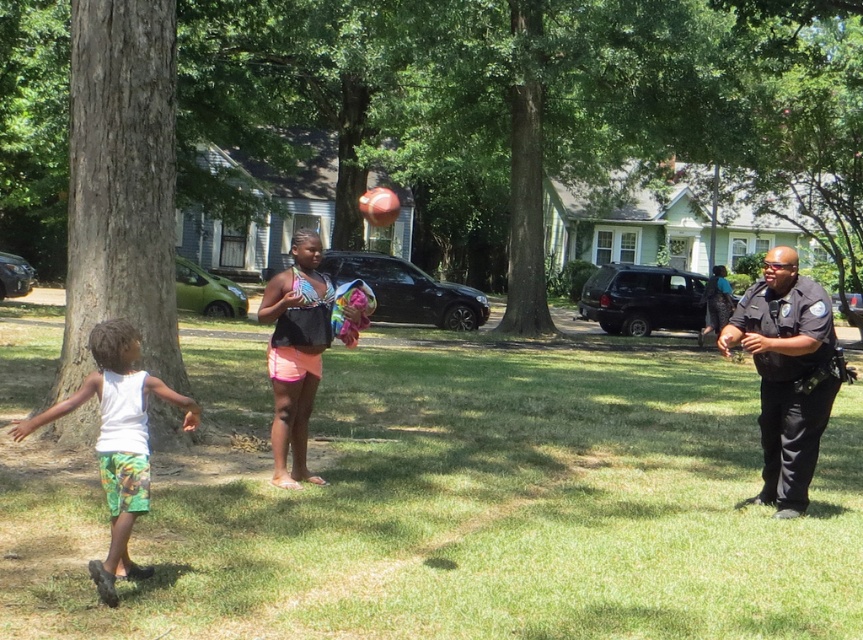
Is brown rough tree at center further to the viewer compared to black uniform at right?

Yes, it is behind black uniform at right.

Can you confirm if brown rough tree at center is shorter than black uniform at right?

In fact, brown rough tree at center may be taller than black uniform at right.

Does point (57, 230) lie in front of point (753, 352)?

No, it is not.

Identify the location of brown rough tree at center. The width and height of the screenshot is (863, 640). (540, 97).

Does brown rough tree at left have a lesser height compared to white cotton tank top at left?

No, brown rough tree at left is not shorter than white cotton tank top at left.

Does brown rough tree at left lie behind white cotton tank top at left?

That is True.

Find the location of a particular element. The width and height of the screenshot is (863, 640). brown rough tree at left is located at coordinates (121, 184).

Where is `brown rough tree at left`? The image size is (863, 640). brown rough tree at left is located at coordinates (121, 184).

Which is in front, point (802, 355) or point (147, 454)?

Point (147, 454) is more forward.

Is point (823, 340) farther from camera compared to point (106, 390)?

Yes.

Find the location of `black uniform at right`. black uniform at right is located at coordinates (786, 374).